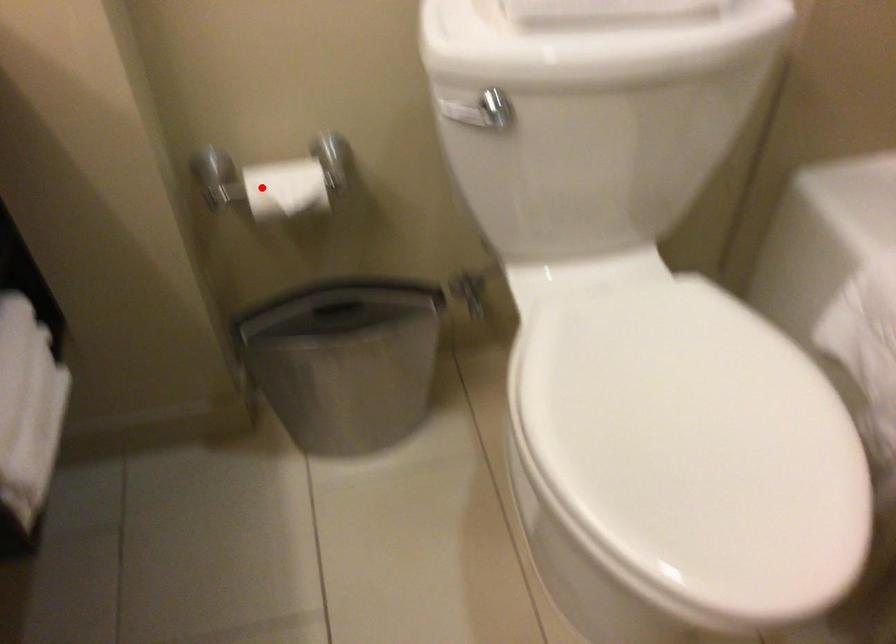
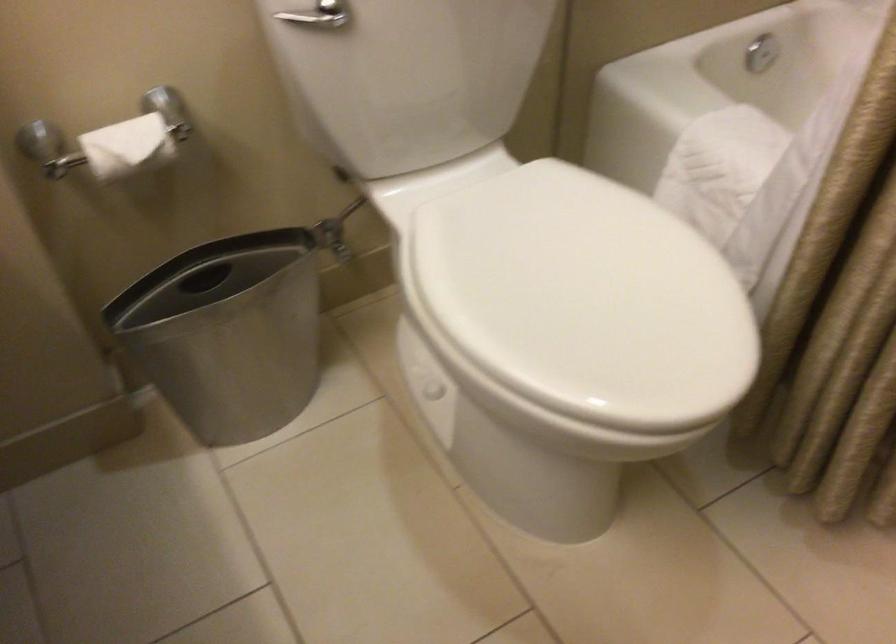
In the second image, find the point that corresponds to the highlighted location in the first image.

(104, 152)